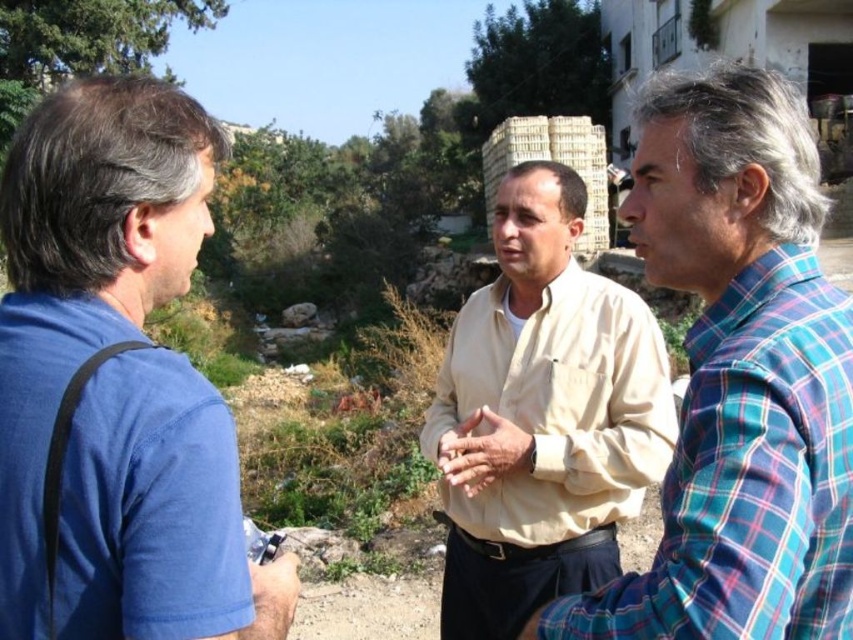
Does plaid cotton shirt at center come behind beige cotton shirt at center?

No.

The height and width of the screenshot is (640, 853). What do you see at coordinates (740, 376) in the screenshot? I see `plaid cotton shirt at center` at bounding box center [740, 376].

What do you see at coordinates (740, 376) in the screenshot? The height and width of the screenshot is (640, 853). I see `plaid cotton shirt at center` at bounding box center [740, 376].

This screenshot has width=853, height=640. What are the coordinates of `plaid cotton shirt at center` in the screenshot? It's located at (740, 376).

Is point (143, 572) behind point (734, 332)?

No, it is not.

Is blue cotton shirt at left to the right of plaid cotton shirt at center from the viewer's perspective?

Incorrect, blue cotton shirt at left is not on the right side of plaid cotton shirt at center.

Between point (132, 460) and point (851, 636), which one is positioned in front?

Point (132, 460) is in front.

Where is `blue cotton shirt at left`? blue cotton shirt at left is located at coordinates (117, 381).

Does point (107, 464) come behind point (631, 483)?

No, it is in front of (631, 483).

Who is shorter, blue cotton shirt at left or beige cotton shirt at center?

blue cotton shirt at left is shorter.

What are the coordinates of `blue cotton shirt at left` in the screenshot? It's located at (117, 381).